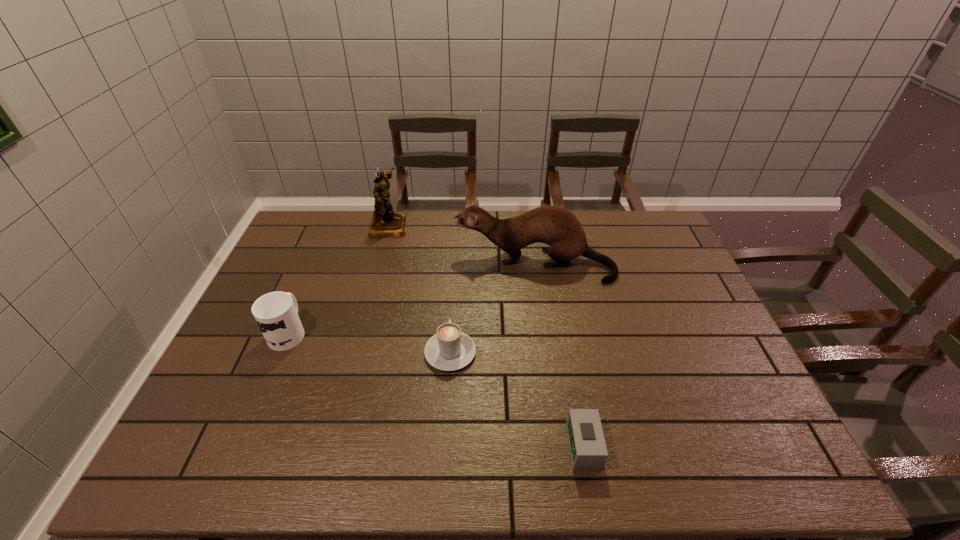
This screenshot has height=540, width=960. What are the coordinates of `free location located 0.160m on the front-facing side of the shortest object` in the screenshot? It's located at (497, 447).

Where is `vacant region located 0.300m on the front-facing side of the shortest object`? Image resolution: width=960 pixels, height=540 pixels. vacant region located 0.300m on the front-facing side of the shortest object is located at coordinates (434, 447).

Locate an element on the screen. This screenshot has height=540, width=960. figurine that is at the far edge is located at coordinates (385, 222).

Find the location of a particular element. The height and width of the screenshot is (540, 960). ferret that is at the far edge is located at coordinates (559, 228).

Identify the location of object that is positioned at the near edge. The height and width of the screenshot is (540, 960). (588, 450).

Locate an element on the screen. object that is at the left edge is located at coordinates (276, 313).

Where is `vacant space at the far edge`? The image size is (960, 540). vacant space at the far edge is located at coordinates (452, 211).

The image size is (960, 540). Identify the location of free space at the near edge. (277, 464).

Where is `vacant space at the left edge of the desktop`? The image size is (960, 540). vacant space at the left edge of the desktop is located at coordinates (304, 286).

In the image, there is a desktop. Where is `vacant space at the right edge`? vacant space at the right edge is located at coordinates point(664,281).